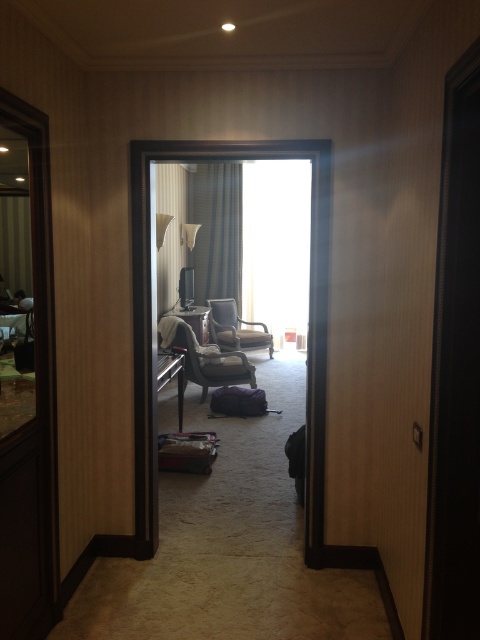
Between transparent glass door at left and satin black armchair at center, which one has more height?

With more height is transparent glass door at left.

Which is above, transparent glass door at left or satin black armchair at center?

satin black armchair at center is higher up.

Which is behind, point (28, 493) or point (194, 310)?

The point (194, 310) is behind.

Locate an element on the screen. transparent glass door at left is located at coordinates (25, 378).

Is black wood door at right below velvet gray armchair at left?

Incorrect, black wood door at right is not positioned below velvet gray armchair at left.

Where is `black wood door at right`? This screenshot has width=480, height=640. black wood door at right is located at coordinates click(456, 372).

Which is in front, point (442, 570) or point (163, 333)?

Positioned in front is point (442, 570).

At what (x,y) coordinates should I click in order to perform the action: click on black wood door at right. Please return your answer as a coordinate pair (x, y). Image resolution: width=480 pixels, height=640 pixels. Looking at the image, I should click on (456, 372).

Who is positioned more to the right, transparent glass door at left or white textured curtain at upper left?

From the viewer's perspective, white textured curtain at upper left appears more on the right side.

Is transparent glass door at left bigger than white textured curtain at upper left?

No, transparent glass door at left is not bigger than white textured curtain at upper left.

You are a GUI agent. You are given a task and a screenshot of the screen. Output one action in this format:
    pyautogui.click(x=<x>, y=<y>)
    Task: Click on the transparent glass door at left
    The width and height of the screenshot is (480, 640).
    Given the screenshot: What is the action you would take?
    pyautogui.click(x=25, y=378)